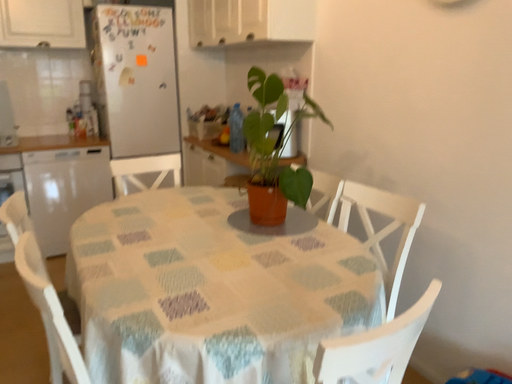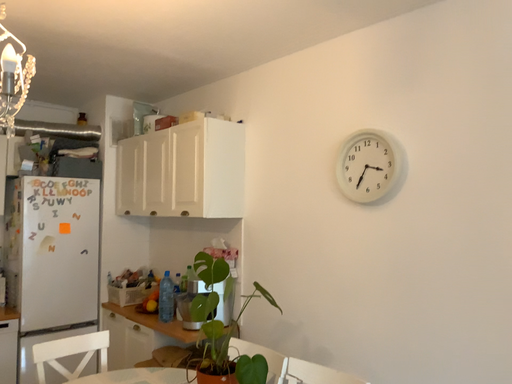
Question: Which way did the camera rotate in the video?

Choices:
 (A) rotated upward
 (B) rotated downward

Answer: (A)